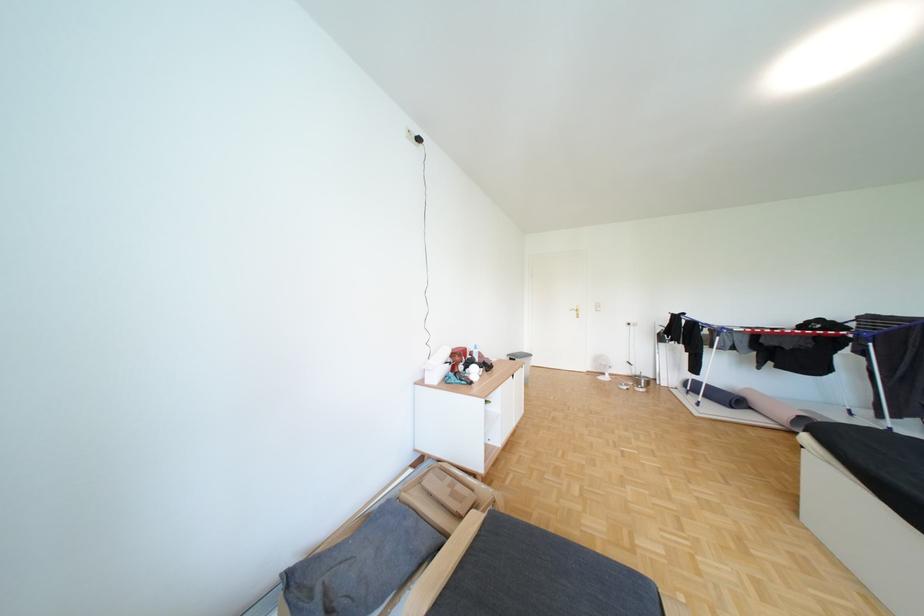
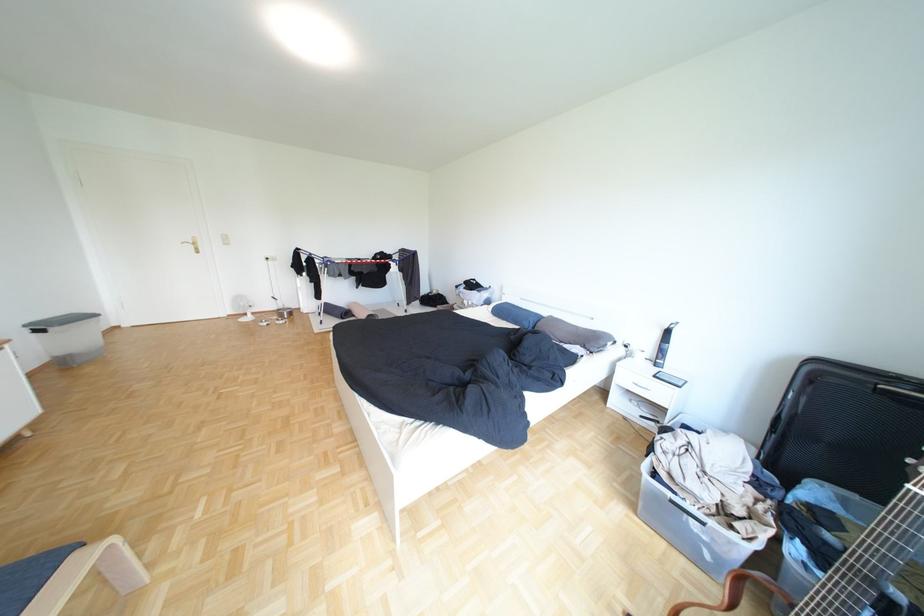
In the second image, find the point that corresponds to (601,367) in the first image.

(238, 310)